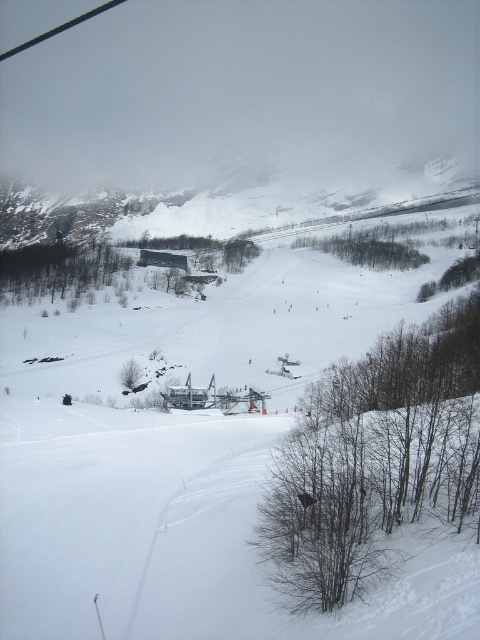
You are a photographer planning to take a wide shot of the mountain landscape. You want to include both the brown leafless trees at lower right and the brown textured tree at center in your frame. Which tree should you focus on to ensure both are in the frame without cropping?

The brown leafless trees at lower right is larger in size compared to the brown textured tree at center. To include both in the frame without cropping, focus on the brown textured tree at center since it is smaller and less likely to be cut off.

You are a photographer planning to take a photo of the brown leafless trees at lower right and the brown textured tree at center. Which tree should you focus on first if you want to capture both in a single shot without moving the camera?

The brown leafless trees at lower right is much taller than the brown textured tree at center, so you should focus on the brown leafless trees at lower right first to ensure they are in frame before adjusting the shot to include the shorter brown textured tree at center.

You are a skier planning to navigate between the brown leafless trees at lower right and the brown textured tree at center. Given that your average skiing speed is 10 meters per second, how long would it take you to travel between them?

The distance between the brown leafless trees at lower right and the brown textured tree at center is 177.11 meters. At a speed of 10 meters per second, it would take approximately 17.71 seconds to travel between them.